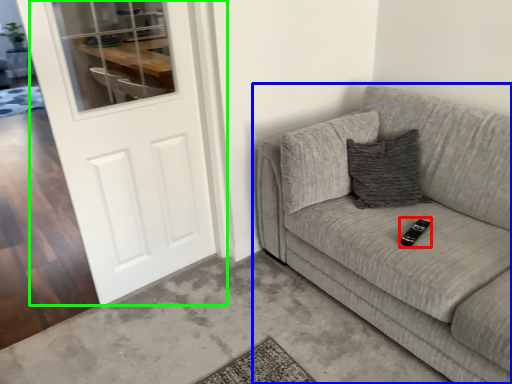
Question: Which is nearer to the remote (highlighted by a red box)? studio couch (highlighted by a blue box) or door (highlighted by a green box).

Choices:
 (A) studio couch
 (B) door

Answer: (A)